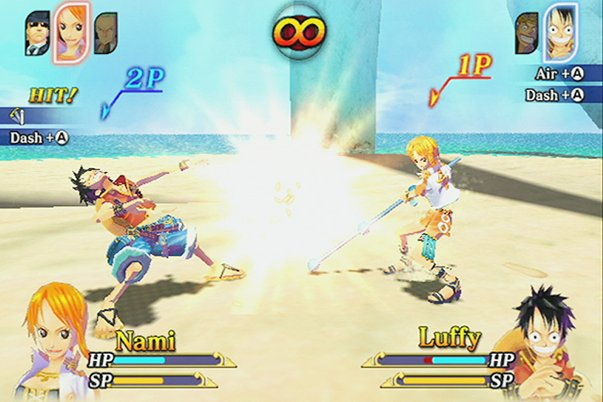
In order to click on white light in this screenshot , I will do pos(309,212), pos(267,196), pos(289,175).